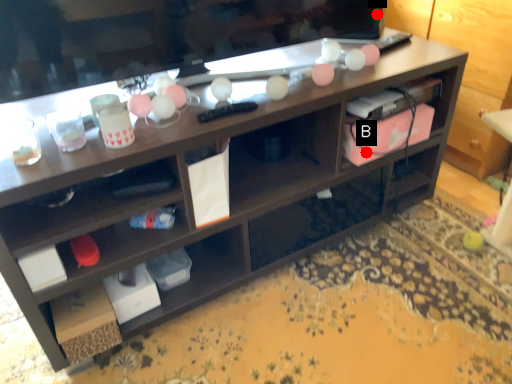
Question: Two points are circled on the image, labeled by A and B beside each circle. Which point is closer to the camera?

Choices:
 (A) A is closer
 (B) B is closer

Answer: (B)